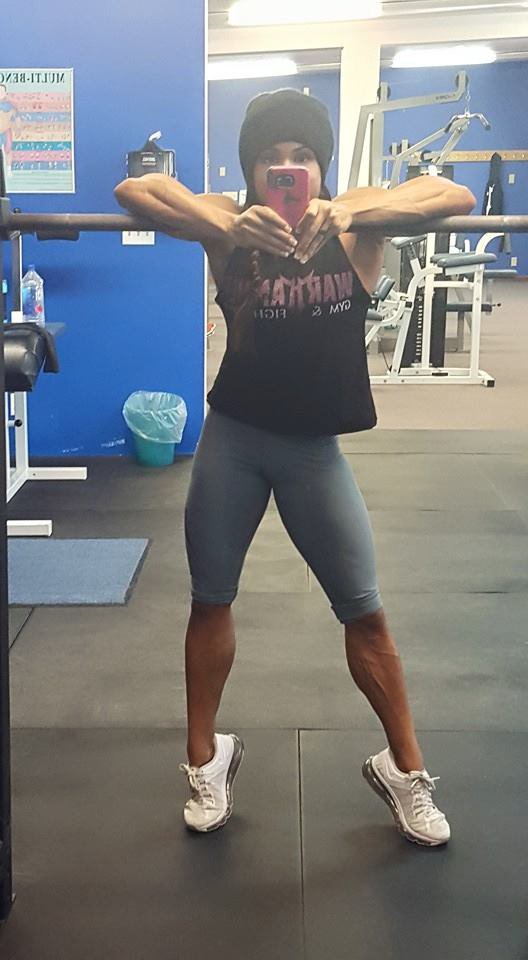
In order to click on wood rack with hooks in this screenshot , I will do `click(472, 156)`.